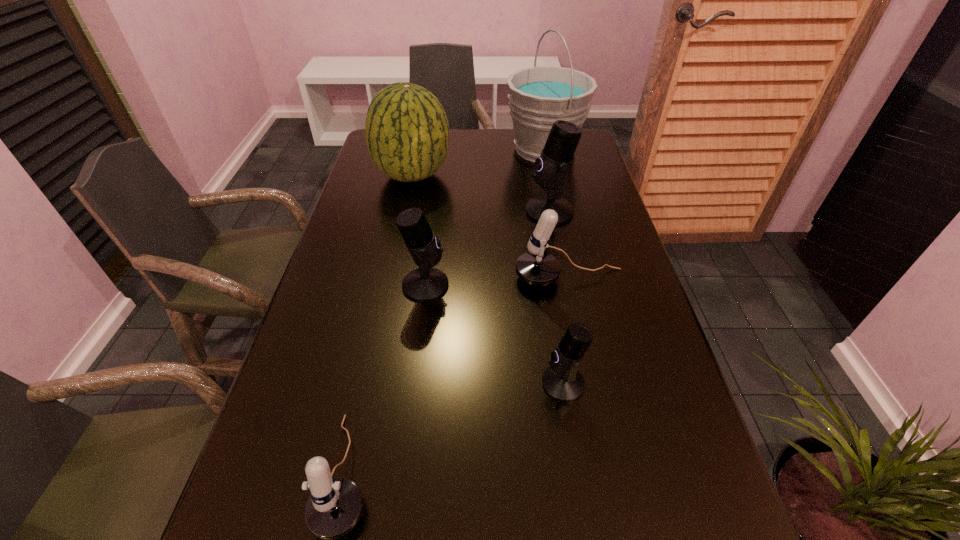
Where is `the sixth farthest object`? the sixth farthest object is located at coordinates (562, 381).

Locate an element on the screen. Image resolution: width=960 pixels, height=540 pixels. vacant region located on the front of the bucket is located at coordinates (557, 207).

The width and height of the screenshot is (960, 540). What are the coordinates of `free space located 0.050m on the back of the green watermelon` in the screenshot? It's located at (419, 149).

I want to click on free location located on the stand of the farthest black microphone, so click(423, 211).

This screenshot has width=960, height=540. I want to click on blank space located 0.250m on the stand of the farthest black microphone, so click(441, 211).

You are a GUI agent. You are given a task and a screenshot of the screen. Output one action in this format:
    pyautogui.click(x=<x>, y=<y>)
    Task: Click on the free location located on the stand of the farthest black microphone
    
    Given the screenshot: What is the action you would take?
    pyautogui.click(x=417, y=211)

The width and height of the screenshot is (960, 540). What are the coordinates of `vacant space located 0.110m on the stand of the leftmost black microphone` in the screenshot? It's located at pos(493,285).

Where is `vacant space located on the back of the bigger white microphone`? vacant space located on the back of the bigger white microphone is located at coordinates (558, 225).

Where is `free point located 0.070m on the stand of the nearest black microphone`? free point located 0.070m on the stand of the nearest black microphone is located at coordinates (507, 383).

Identify the location of vacant space situated on the stand of the nearest black microphone. Image resolution: width=960 pixels, height=540 pixels. (391, 383).